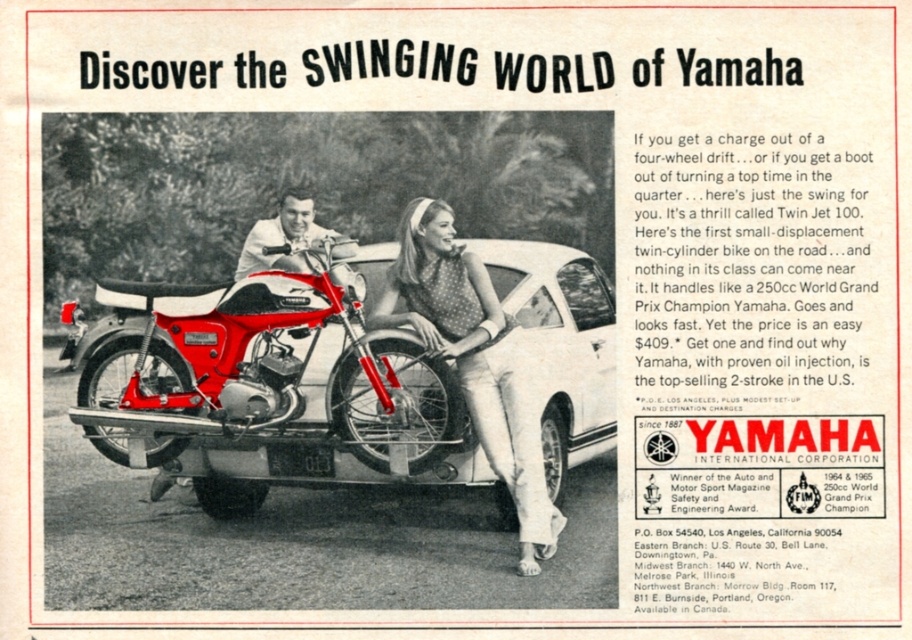
In the scene shown: You are designing a parking space for the white matte car at center and need to ensure there is enough room for the shiny chrome handlebars at center. Based on the image, is the car wider than the handlebars?

The white matte car at center might be wider than shiny chrome handlebars at center, so it is possible that the car is wider, but the exact width difference isn

You are a photographer reviewing this vintage Yamaha ad. You notice the white matte car at center and the dotted fabric dress at center. Based on their positions, which object is closer to the left edge of the image?

The dotted fabric dress at center is closer to the left edge of the image because the white matte car at center is positioned on the right side of it.